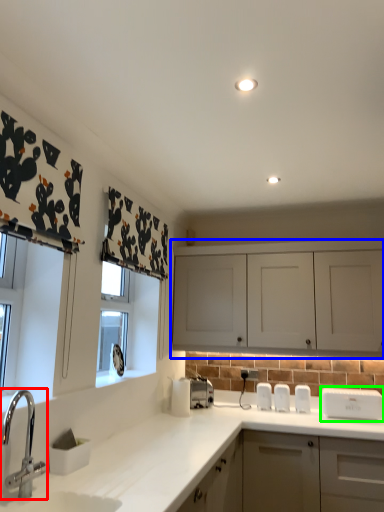
Question: Estimate the real-world distances between objects in this image. Which object is closer to tap (highlighted by a red box), cabinetry (highlighted by a blue box) or appliance (highlighted by a green box)?

Choices:
 (A) cabinetry
 (B) appliance

Answer: (A)